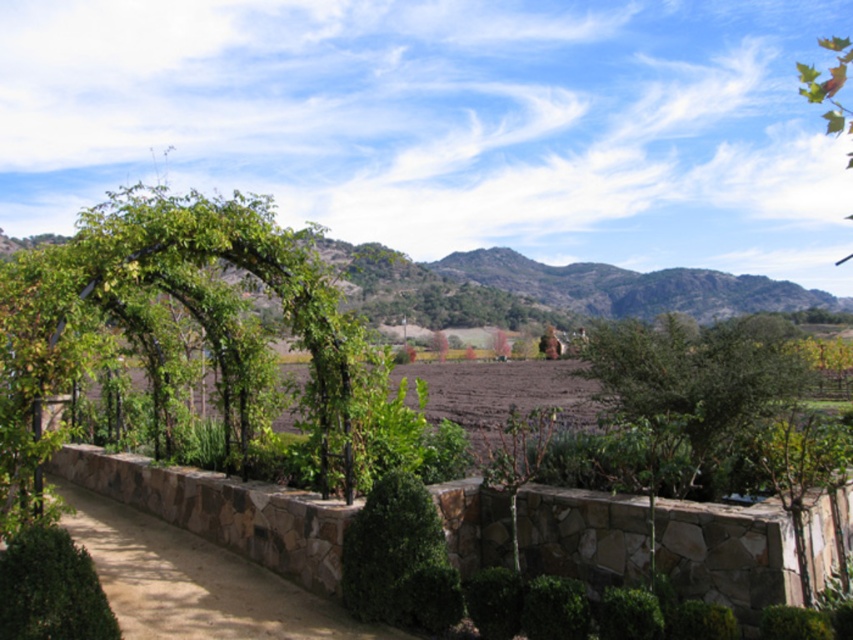
Question: Is green leafy tree at center to the right of green leafy bush at lower left from the viewer's perspective?

Choices:
 (A) yes
 (B) no

Answer: (A)

Question: Which point is farther to the camera?

Choices:
 (A) green leafy bush at lower left
 (B) green leafy tree at center

Answer: (B)

Question: Can you confirm if green leafy tree at center is positioned below green leafy bush at lower left?

Choices:
 (A) no
 (B) yes

Answer: (A)

Question: Which point is closer to the camera?

Choices:
 (A) green leafy tree at center
 (B) green leafy bush at lower left

Answer: (B)

Question: Can you confirm if green leafy tree at center is smaller than green leafy bush at lower left?

Choices:
 (A) yes
 (B) no

Answer: (B)

Question: Which of the following is the farthest from the observer?

Choices:
 (A) green leafy tree at center
 (B) green leafy bush at lower left

Answer: (A)